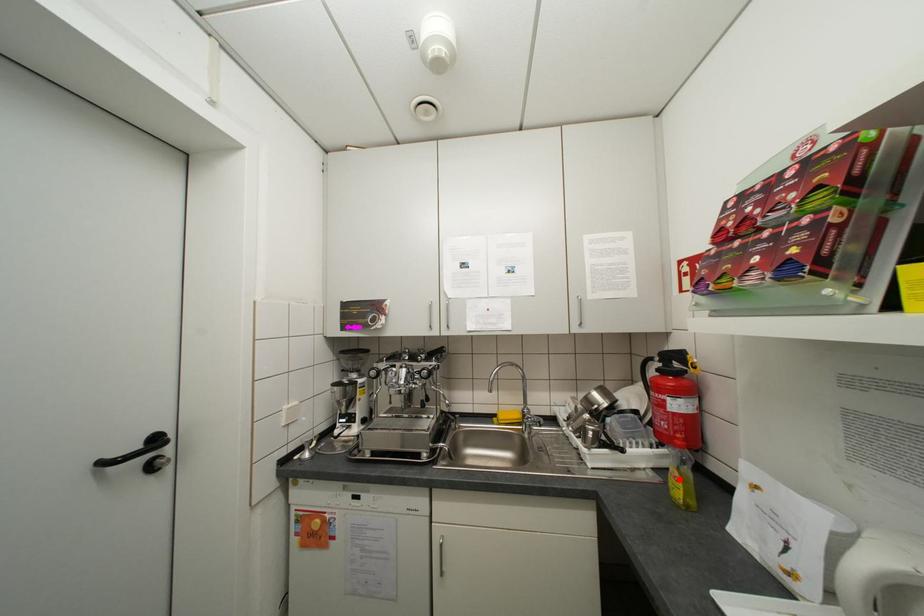
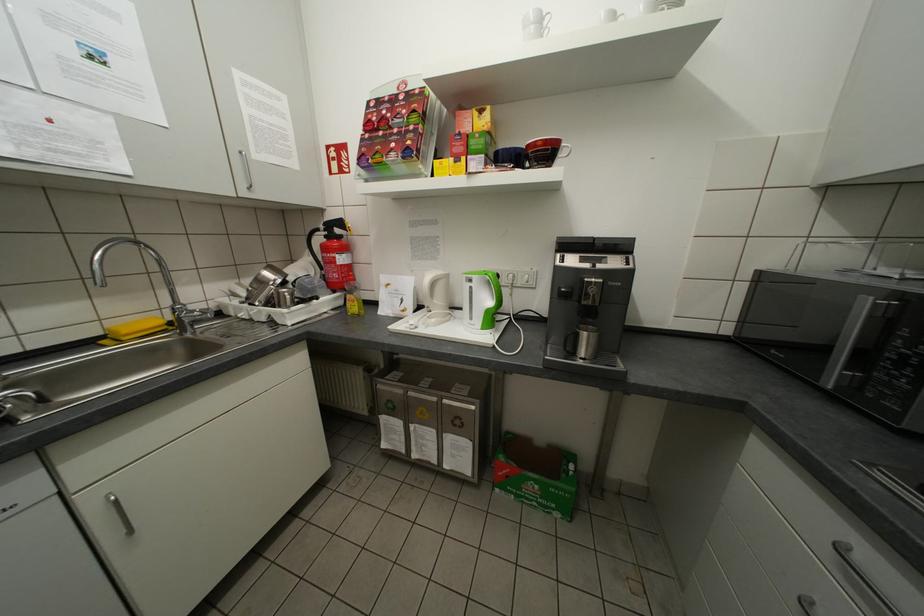
In the second image, find the point that corresponds to the highlighted location in the first image.

(357, 305)